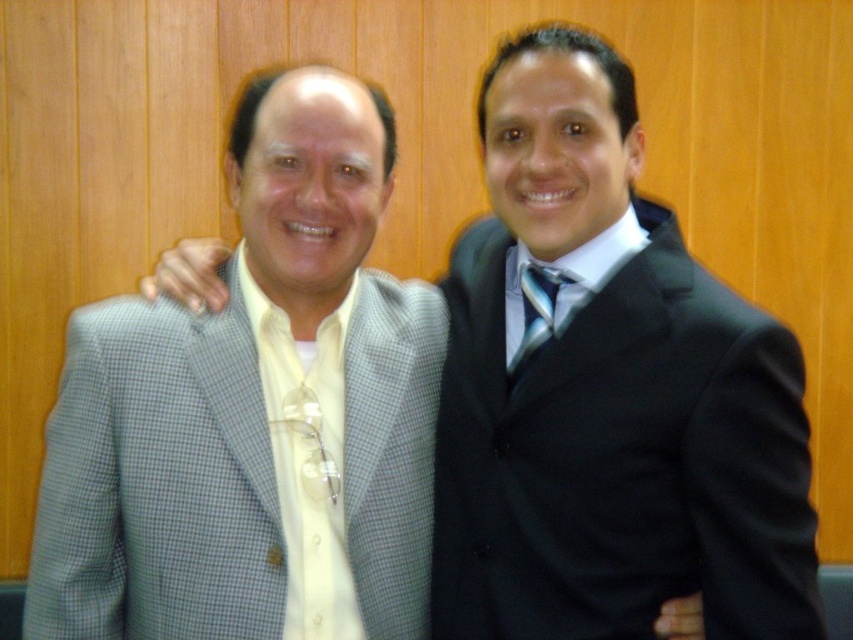
Question: Does black satin suit at right lie in front of shiny blue tie at center?

Choices:
 (A) yes
 (B) no

Answer: (A)

Question: Is the position of black satin suit at right more distant than that of shiny blue tie at center?

Choices:
 (A) yes
 (B) no

Answer: (B)

Question: Which point is farther from the camera taking this photo?

Choices:
 (A) (548, 326)
 (B) (485, 600)

Answer: (A)

Question: Which of the following is the farthest from the observer?

Choices:
 (A) (614, 433)
 (B) (128, 493)

Answer: (B)

Question: Does gray checkered suit at left appear under black satin suit at right?

Choices:
 (A) no
 (B) yes

Answer: (A)

Question: Which of these objects is positioned farthest from the black satin suit at right?

Choices:
 (A) gray checkered suit at left
 (B) shiny blue tie at center

Answer: (A)